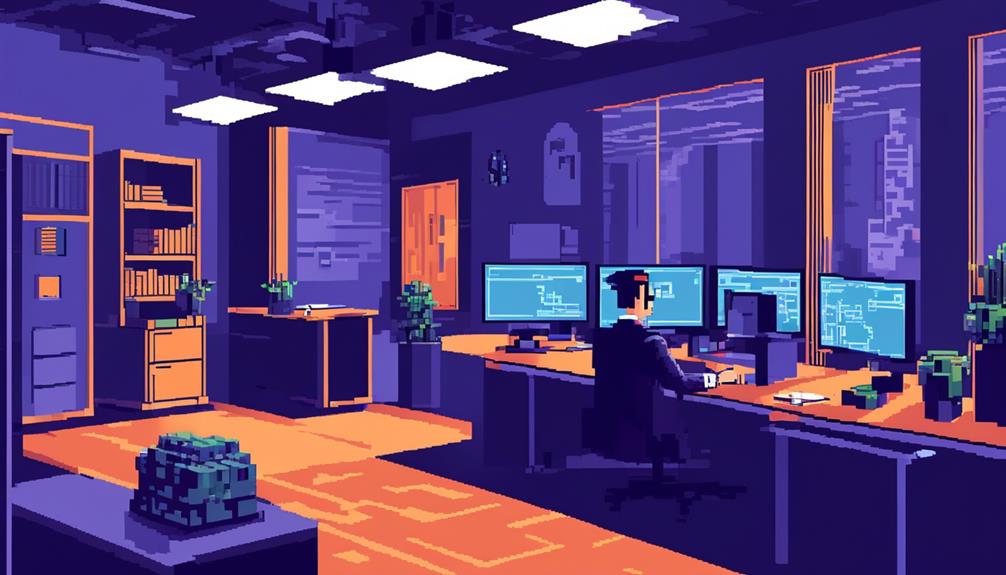
This screenshot has width=1006, height=575. Find the location of `bookshelves`. bookshelves is located at coordinates (136, 233), (45, 223).